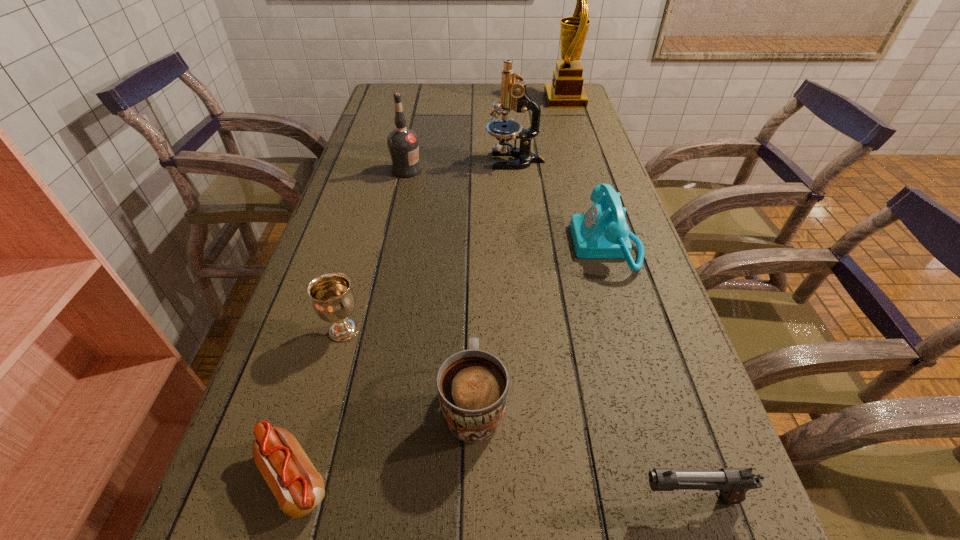
Identify the location of vacant space located 0.200m on the front-facing side of the award. The width and height of the screenshot is (960, 540). (492, 100).

Find the location of a particular element. Image resolution: width=960 pixels, height=540 pixels. vacant region located on the front-facing side of the award is located at coordinates (437, 100).

Locate an element on the screen. The height and width of the screenshot is (540, 960). vacant space situated 0.220m at the eyepiece of the microscope is located at coordinates (412, 160).

Find the location of a particular element. The image size is (960, 540). free point located 0.390m at the eyepiece of the microscope is located at coordinates (354, 160).

In order to click on vacant space situated at the eyepiece of the microscope in this screenshot , I will do `click(442, 160)`.

Find the location of a particular element. The image size is (960, 540). free space located on the front label of the vodka is located at coordinates (481, 170).

Where is `free space located on the dial of the telephone`? free space located on the dial of the telephone is located at coordinates (455, 246).

The height and width of the screenshot is (540, 960). Identify the location of vacant region located on the dial of the telephone. (527, 246).

Find the location of a particular element. This screenshot has height=540, width=960. vacant region located on the dial of the telephone is located at coordinates (468, 246).

Locate an element on the screen. free space located on the front of the fourth nearest object is located at coordinates click(318, 426).